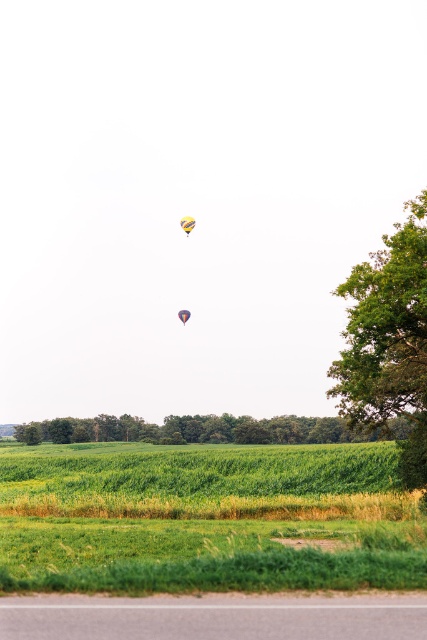
You are a photographer trying to capture the multicolored fabric balloon at center against the green grassy field at lower center. Which object will appear larger in the photo?

The multicolored fabric balloon at center appears larger in the photo because it is taller than the green grassy field at lower center.

You are standing at the edge of the paved road in the rural landscape. You see two points marked in the scene. Which point is closer to you, point (181, 224) or point (186, 308)?

Point (181, 224) is closer to the viewer than point (186, 308).